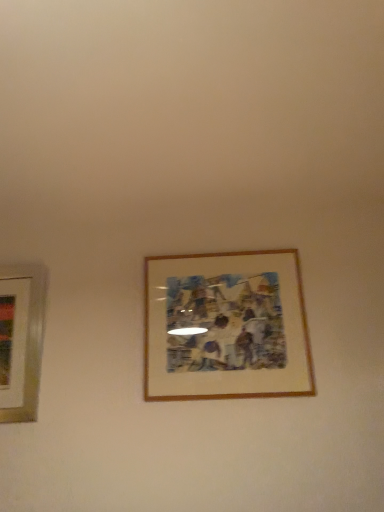
Describe the element at coordinates (21, 340) in the screenshot. I see `matte white picture frame at left, the first picture frame viewed from the left` at that location.

Looking at this image, how much space does matte white picture frame at left, which ranks as the second picture frame in right-to-left order, occupy horizontally?

matte white picture frame at left, which ranks as the second picture frame in right-to-left order, is 3.58 inches in width.

Locate an element on the screen. matte white picture frame at left, the first picture frame viewed from the left is located at coordinates (21, 340).

Image resolution: width=384 pixels, height=512 pixels. What are the coordinates of `wooden-framed artwork at center, which is counted as the second picture frame, starting from the left` in the screenshot? It's located at (226, 326).

How much space does wooden-framed artwork at center, which is counted as the second picture frame, starting from the left, occupy vertically?

76.49 centimeters.

Measure the distance between wooden-framed artwork at center, acting as the 1th picture frame starting from the right, and camera.

6.67 feet.

In the scene shown: Measure the distance between point [181,320] and camera.

They are 7.16 feet apart.

The width and height of the screenshot is (384, 512). What do you see at coordinates (226, 326) in the screenshot?
I see `wooden-framed artwork at center, acting as the 1th picture frame starting from the right` at bounding box center [226, 326].

You are a GUI agent. You are given a task and a screenshot of the screen. Output one action in this format:
    pyautogui.click(x=<x>, y=<y>)
    Task: Click on the matte white picture frame at left, the first picture frame viewed from the left
    This screenshot has width=384, height=512.
    Given the screenshot: What is the action you would take?
    pyautogui.click(x=21, y=340)

Between matte white picture frame at left, the first picture frame viewed from the left, and wooden-framed artwork at center, acting as the 1th picture frame starting from the right, which one appears on the left side from the viewer's perspective?

Positioned to the left is matte white picture frame at left, the first picture frame viewed from the left.

Is matte white picture frame at left, which ranks as the second picture frame in right-to-left order, further to camera compared to wooden-framed artwork at center, which is counted as the second picture frame, starting from the left?

Yes, matte white picture frame at left, which ranks as the second picture frame in right-to-left order, is further from the viewer.

Considering the positions of points (27, 352) and (211, 292), is point (27, 352) farther from camera compared to point (211, 292)?

No, (27, 352) is closer to viewer.

From the image's perspective, is matte white picture frame at left, which ranks as the second picture frame in right-to-left order, beneath wooden-framed artwork at center, which is counted as the second picture frame, starting from the left?

Indeed, from the image's perspective, matte white picture frame at left, which ranks as the second picture frame in right-to-left order, is shown beneath wooden-framed artwork at center, which is counted as the second picture frame, starting from the left.

From a real-world perspective, which object rests below the other?

matte white picture frame at left, which ranks as the second picture frame in right-to-left order.

Which of these two, matte white picture frame at left, which ranks as the second picture frame in right-to-left order, or wooden-framed artwork at center, acting as the 1th picture frame starting from the right, is thinner?

With smaller width is wooden-framed artwork at center, acting as the 1th picture frame starting from the right.

From their relative heights in the image, would you say matte white picture frame at left, which ranks as the second picture frame in right-to-left order, is taller or shorter than wooden-framed artwork at center, acting as the 1th picture frame starting from the right?

Considering their sizes, matte white picture frame at left, which ranks as the second picture frame in right-to-left order, has more height than wooden-framed artwork at center, acting as the 1th picture frame starting from the right.

Who is bigger, matte white picture frame at left, which ranks as the second picture frame in right-to-left order, or wooden-framed artwork at center, acting as the 1th picture frame starting from the right?

wooden-framed artwork at center, acting as the 1th picture frame starting from the right.

Choose the correct answer: Is matte white picture frame at left, which ranks as the second picture frame in right-to-left order, inside wooden-framed artwork at center, which is counted as the second picture frame, starting from the left, or outside it?

matte white picture frame at left, which ranks as the second picture frame in right-to-left order, is outside wooden-framed artwork at center, which is counted as the second picture frame, starting from the left.

Are matte white picture frame at left, the first picture frame viewed from the left, and wooden-framed artwork at center, acting as the 1th picture frame starting from the right, beside each other?

No.

Is matte white picture frame at left, which ranks as the second picture frame in right-to-left order, turned away from wooden-framed artwork at center, which is counted as the second picture frame, starting from the left?

No, matte white picture frame at left, which ranks as the second picture frame in right-to-left order, is not facing the opposite direction of wooden-framed artwork at center, which is counted as the second picture frame, starting from the left.

The image size is (384, 512). I want to click on picture frame located behind the wooden-framed artwork at center, acting as the 1th picture frame starting from the right, so click(21, 340).

Which object is positioned more to the right, wooden-framed artwork at center, acting as the 1th picture frame starting from the right, or matte white picture frame at left, which ranks as the second picture frame in right-to-left order?

From the viewer's perspective, wooden-framed artwork at center, acting as the 1th picture frame starting from the right, appears more on the right side.

Does wooden-framed artwork at center, which is counted as the second picture frame, starting from the left, lie in front of matte white picture frame at left, the first picture frame viewed from the left?

Yes, it is.

Is point (156, 393) positioned after point (0, 387)?

No.

From the image's perspective, relative to matte white picture frame at left, the first picture frame viewed from the left, is wooden-framed artwork at center, acting as the 1th picture frame starting from the right, above or below?

wooden-framed artwork at center, acting as the 1th picture frame starting from the right, is above matte white picture frame at left, the first picture frame viewed from the left.

From a real-world perspective, is wooden-framed artwork at center, acting as the 1th picture frame starting from the right, positioned over matte white picture frame at left, which ranks as the second picture frame in right-to-left order, based on gravity?

Yes, from a real-world perspective, wooden-framed artwork at center, acting as the 1th picture frame starting from the right, is on top of matte white picture frame at left, which ranks as the second picture frame in right-to-left order.

Is wooden-framed artwork at center, which is counted as the second picture frame, starting from the left, thinner than matte white picture frame at left, which ranks as the second picture frame in right-to-left order?

Yes.

Considering the sizes of wooden-framed artwork at center, which is counted as the second picture frame, starting from the left, and matte white picture frame at left, the first picture frame viewed from the left, in the image, is wooden-framed artwork at center, which is counted as the second picture frame, starting from the left, taller or shorter than matte white picture frame at left, the first picture frame viewed from the left,?

Clearly, wooden-framed artwork at center, which is counted as the second picture frame, starting from the left, is shorter compared to matte white picture frame at left, the first picture frame viewed from the left.

Can you confirm if wooden-framed artwork at center, which is counted as the second picture frame, starting from the left, is bigger than matte white picture frame at left, which ranks as the second picture frame in right-to-left order?

Yes, wooden-framed artwork at center, which is counted as the second picture frame, starting from the left, is bigger than matte white picture frame at left, which ranks as the second picture frame in right-to-left order.

Would you say wooden-framed artwork at center, which is counted as the second picture frame, starting from the left, is outside matte white picture frame at left, which ranks as the second picture frame in right-to-left order?

Yes, wooden-framed artwork at center, which is counted as the second picture frame, starting from the left, is located beyond the bounds of matte white picture frame at left, which ranks as the second picture frame in right-to-left order.

Does wooden-framed artwork at center, acting as the 1th picture frame starting from the right, turn towards matte white picture frame at left, which ranks as the second picture frame in right-to-left order?

No, wooden-framed artwork at center, acting as the 1th picture frame starting from the right, is not facing towards matte white picture frame at left, which ranks as the second picture frame in right-to-left order.

Measure the distance between wooden-framed artwork at center, acting as the 1th picture frame starting from the right, and matte white picture frame at left, the first picture frame viewed from the left.

They are 34.26 inches apart.

The height and width of the screenshot is (512, 384). Identify the location of picture frame below the wooden-framed artwork at center, acting as the 1th picture frame starting from the right (from the image's perspective). [x=21, y=340].

Identify the location of picture frame above the matte white picture frame at left, the first picture frame viewed from the left (from a real-world perspective). (226, 326).

In order to click on picture frame on the left of wooden-framed artwork at center, which is counted as the second picture frame, starting from the left in this screenshot , I will do `click(21, 340)`.